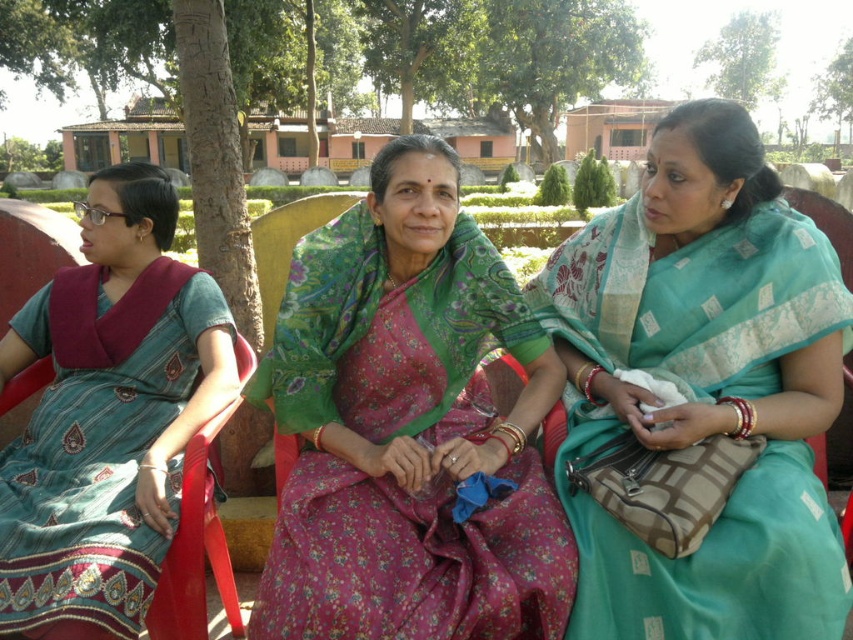
You are a photographer standing in the park and want to take a photo of the three women wearing colorful sarees. You notice two points in the scene labeled as point (403, 285) and point (712, 170). Which point is closer to you, the photographer?

Point (403, 285) is closer to the photographer because it is further to the viewer than point (712, 170).

You are a photographer setting up for a group photo of the three women wearing teal silk sarees. You need to arrange them so that the teal silk saree at center and the teal silk saree at left are positioned correctly according to their labels. Which side should each of these two women stand on relative to each other?

The teal silk saree at center should be positioned to the right of the teal silk saree at left, as per their labels.

You are a photographer planning to take a group photo of the women in the scene. You need to arrange them so that the green floral saree at center and the teal silk saree at left are visible in the frame. Considering their heights, which woman should stand closer to the front to ensure both are fully visible?

The teal silk saree at left should stand closer to the front because the green floral saree at center is taller, allowing both to be visible without one blocking the other.